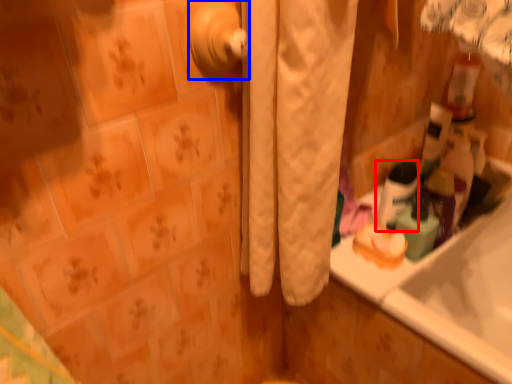
Question: Which point is further to the camera, mouthwash (highlighted by a red box) or door handle (highlighted by a blue box)?

Choices:
 (A) mouthwash
 (B) door handle

Answer: (A)